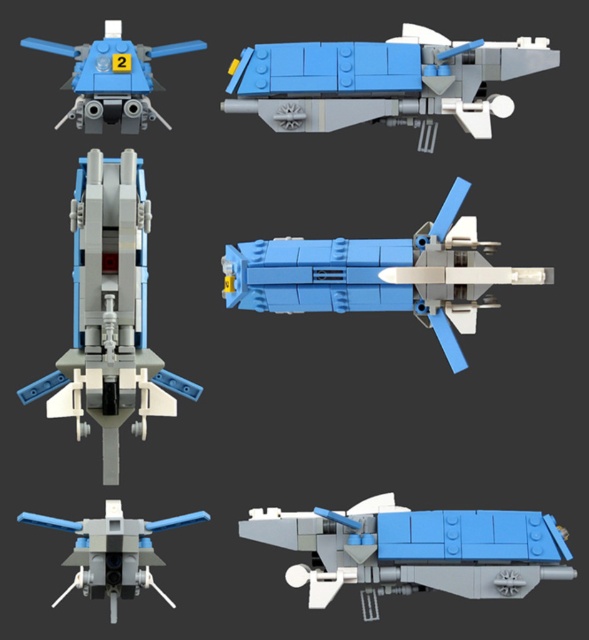
Question: Which object appears farthest from the camera in this image?

Choices:
 (A) blue matte spaceship at center
 (B) matte gray/white spaceship at center
 (C) matte blue spaceship at center
 (D) matte blue plastic spaceship at upper left

Answer: (D)

Question: Which point is closer to the camera?

Choices:
 (A) matte blue plastic spaceship at bottom left
 (B) matte blue spaceship at center

Answer: (A)

Question: Can you confirm if blue plastic spaceship at upper center is positioned to the right of matte blue plastic spaceship at bottom left?

Choices:
 (A) no
 (B) yes

Answer: (B)

Question: Is blue matte spaceship at center positioned before matte blue plastic spaceship at bottom left?

Choices:
 (A) yes
 (B) no

Answer: (A)

Question: Which of the following is the farthest from the observer?

Choices:
 (A) (200, 513)
 (B) (505, 273)

Answer: (B)

Question: Does blue plastic spaceship at upper center have a lesser width compared to matte gray/white spaceship at center?

Choices:
 (A) no
 (B) yes

Answer: (A)